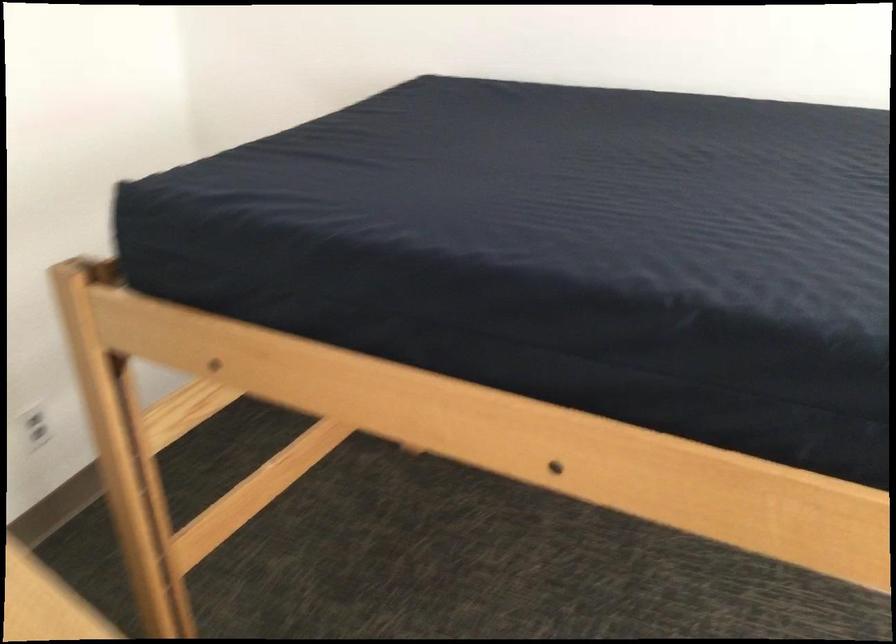
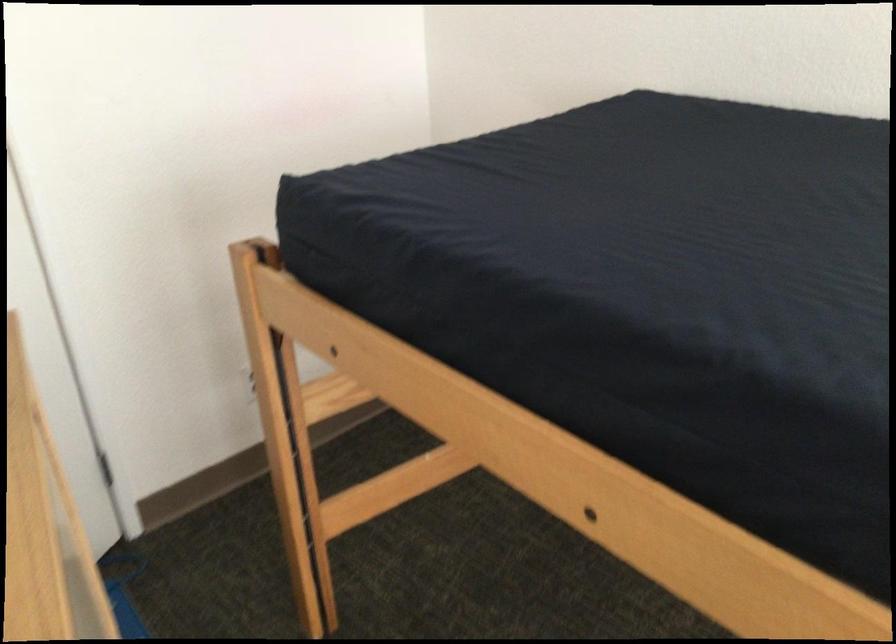
In the second image, find the point that corresponds to (x=519, y=202) in the first image.

(636, 228)